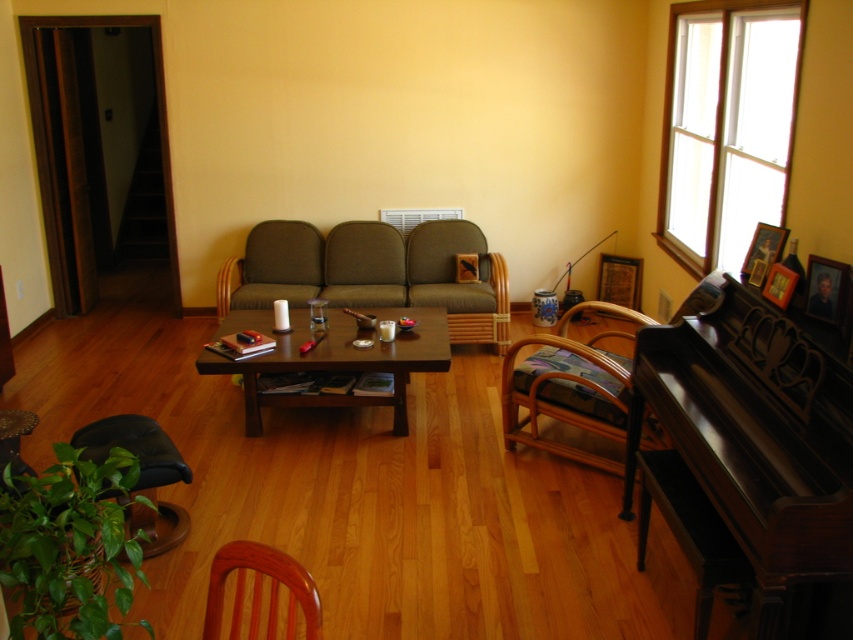
Question: Which point appears farthest from the camera in this image?

Choices:
 (A) (674, 193)
 (B) (439, 257)
 (C) (146, 492)
 (D) (270, 624)

Answer: (B)

Question: Does wooden chair at lower left appear under black leather chair at lower left?

Choices:
 (A) no
 (B) yes

Answer: (B)

Question: Is white wooden window at upper right positioned before black leather chair at lower left?

Choices:
 (A) no
 (B) yes

Answer: (A)

Question: Does green fabric couch at center have a lesser width compared to wooden chair at lower left?

Choices:
 (A) no
 (B) yes

Answer: (A)

Question: Among these objects, which one is nearest to the camera?

Choices:
 (A) black leather chair at lower left
 (B) dark polished wood piano at right
 (C) green fabric couch at center
 (D) wooden chair at lower left

Answer: (D)

Question: Which point is farther from the camera taking this photo?

Choices:
 (A) (146, 554)
 (B) (241, 612)
 (C) (697, 394)
 (D) (296, 316)

Answer: (D)